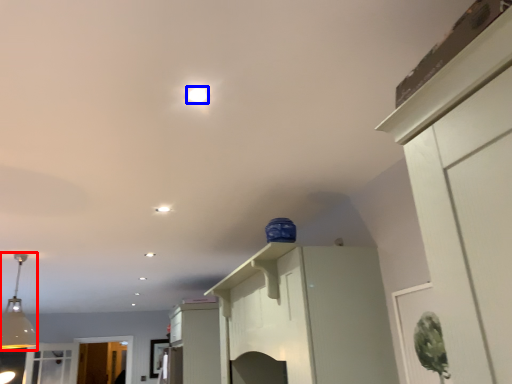
Question: Among these objects, which one is nearest to the camera, light fixture (highlighted by a red box) or lighting (highlighted by a blue box)?

Choices:
 (A) light fixture
 (B) lighting

Answer: (B)